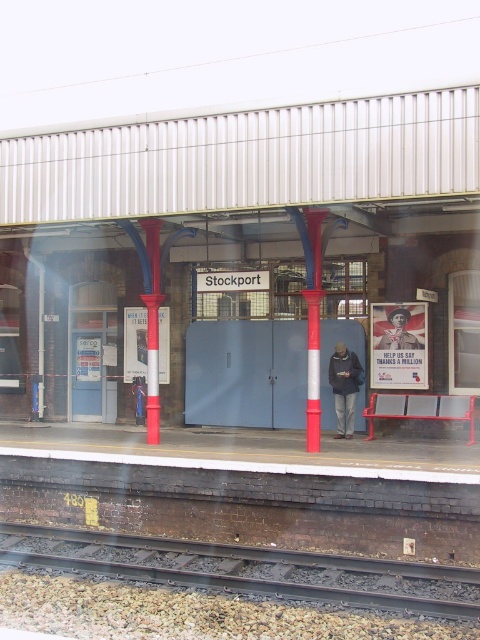
You are a maintenance worker checking the platform for safety hazards. You notice the smooth metal track at lower center and the dark blue jacket at center. Which object is shorter in height?

The smooth metal track at lower center has a lesser height compared to dark blue jacket at center, so the smooth metal track at lower center is shorter in height.

Consider the image. You are a station attendant checking the platform for safety. You notice the smooth metal track at lower center and the matte black jacket at center. Which object is wider?

The smooth metal track at lower center is wider than the matte black jacket at center.